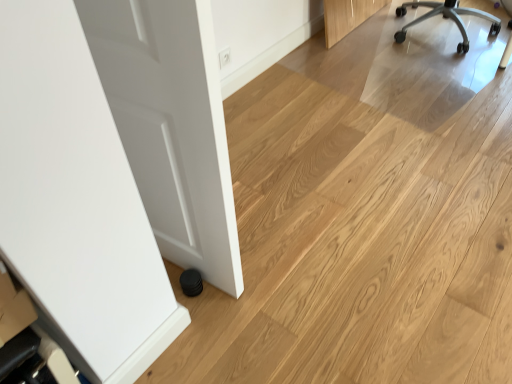
Find the location of a particular element. This screenshot has height=384, width=512. silver metallic chair at upper right is located at coordinates (446, 17).

Describe the element at coordinates (446, 17) in the screenshot. I see `silver metallic chair at upper right` at that location.

What do you see at coordinates (170, 125) in the screenshot? Image resolution: width=512 pixels, height=384 pixels. I see `white glossy door at left` at bounding box center [170, 125].

Find the location of a particular element. The image size is (512, 384). white glossy door at left is located at coordinates (170, 125).

At what (x,y) coordinates should I click in order to perform the action: click on silver metallic chair at upper right. Please return your answer as a coordinate pair (x, y). The width and height of the screenshot is (512, 384). Looking at the image, I should click on (446, 17).

Between silver metallic chair at upper right and white glossy door at left, which one appears on the left side from the viewer's perspective?

Positioned to the left is white glossy door at left.

Relative to white glossy door at left, is silver metallic chair at upper right in front or behind?

Clearly, silver metallic chair at upper right is behind white glossy door at left.

Between point (433, 7) and point (197, 246), which one is positioned in front?

The point (197, 246) is closer.

From the image's perspective, is silver metallic chair at upper right located above or below white glossy door at left?

silver metallic chair at upper right is above white glossy door at left.

From a real-world perspective, relative to white glossy door at left, is silver metallic chair at upper right vertically above or below?

In terms of real-world spatial position, silver metallic chair at upper right is below white glossy door at left.

Does silver metallic chair at upper right have a greater width compared to white glossy door at left?

Yes, silver metallic chair at upper right is wider than white glossy door at left.

Who is taller, silver metallic chair at upper right or white glossy door at left?

white glossy door at left.

Which of these two, silver metallic chair at upper right or white glossy door at left, is smaller?

white glossy door at left.

Is silver metallic chair at upper right spatially inside white glossy door at left, or outside of it?

silver metallic chair at upper right is not inside white glossy door at left, it's outside.

Is there a large distance between silver metallic chair at upper right and white glossy door at left?

That's right, there is a large distance between silver metallic chair at upper right and white glossy door at left.

Is silver metallic chair at upper right oriented away from white glossy door at left?

silver metallic chair at upper right does not have its back to white glossy door at left.

How different are the orientations of silver metallic chair at upper right and white glossy door at left in degrees?

silver metallic chair at upper right and white glossy door at left are facing 41.3 degrees away from each other.

The image size is (512, 384). Find the location of `chair below the white glossy door at left (from a real-world perspective)`. chair below the white glossy door at left (from a real-world perspective) is located at coordinates (446, 17).

Which is more to the left, white glossy door at left or silver metallic chair at upper right?

Positioned to the left is white glossy door at left.

Based on the photo, is white glossy door at left in front of or behind silver metallic chair at upper right in the image?

white glossy door at left is positioned closer to the viewer than silver metallic chair at upper right.

Which point is more distant from viewer, [148,138] or [437,9]?

Positioned behind is point [437,9].

From the image's perspective, which one is positioned higher, white glossy door at left or silver metallic chair at upper right?

From the image's view, silver metallic chair at upper right is above.

From a real-world perspective, who is located higher, white glossy door at left or silver metallic chair at upper right?

white glossy door at left, from a real-world perspective.

Which of these two, white glossy door at left or silver metallic chair at upper right, is thinner?

With smaller width is white glossy door at left.

Does white glossy door at left have a greater height compared to silver metallic chair at upper right?

Yes.

Does white glossy door at left have a larger size compared to silver metallic chair at upper right?

No, white glossy door at left is not bigger than silver metallic chair at upper right.

From the picture: Is white glossy door at left inside or outside of silver metallic chair at upper right?

white glossy door at left lies outside silver metallic chair at upper right.

Would you consider white glossy door at left to be distant from silver metallic chair at upper right?

That's right, there is a large distance between white glossy door at left and silver metallic chair at upper right.

Is white glossy door at left facing away from silver metallic chair at upper right?

white glossy door at left does not have its back to silver metallic chair at upper right.

What's the angular difference between white glossy door at left and silver metallic chair at upper right's facing directions?

white glossy door at left and silver metallic chair at upper right are facing 41.3 degrees away from each other.

At what (x,y) coordinates should I click in order to perform the action: click on chair lying above the white glossy door at left (from the image's perspective). Please return your answer as a coordinate pair (x, y). Looking at the image, I should click on (446, 17).

Find the location of a particular element. chair directly beneath the white glossy door at left (from a real-world perspective) is located at coordinates (446, 17).

Identify the location of door above the silver metallic chair at upper right (from a real-world perspective). Image resolution: width=512 pixels, height=384 pixels. (170, 125).